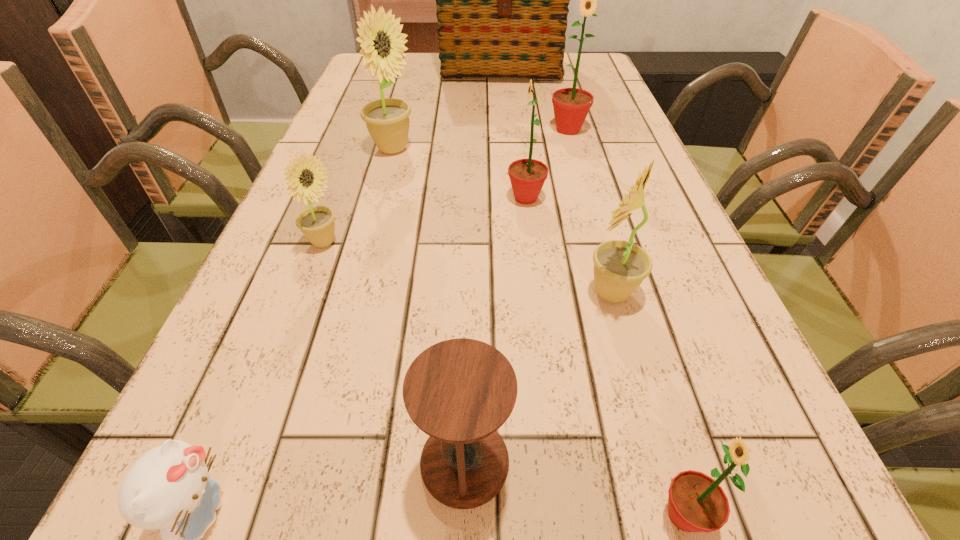
The image size is (960, 540). Identify the location of shopping bag. (502, 0).

Where is `the farthest object`? the farthest object is located at coordinates (502, 0).

Locate an element on the screen. This screenshot has width=960, height=540. the farthest yellow sunflower is located at coordinates click(387, 120).

Identify the location of the biggest green sunflower. (571, 105).

You are a GUI agent. You are given a task and a screenshot of the screen. Output one action in this format:
    pyautogui.click(x=<x>, y=<y>)
    Task: Click on the fourth nearest object
    This screenshot has width=960, height=540.
    Given the screenshot: What is the action you would take?
    pyautogui.click(x=620, y=266)

Image resolution: width=960 pixels, height=540 pixels. Identify the location of the rightmost yellow sunflower. tap(620, 266).

Where is `the sixth nearest object`? The height and width of the screenshot is (540, 960). the sixth nearest object is located at coordinates (527, 176).

Identify the location of the fourth sunflower from right to left. This screenshot has height=540, width=960. (527, 176).

Find the location of a particular element. The image size is (960, 540). the smallest yellow sunflower is located at coordinates (317, 224).

Find the location of a particular element. The width and height of the screenshot is (960, 540). the fifth nearest object is located at coordinates (317, 224).